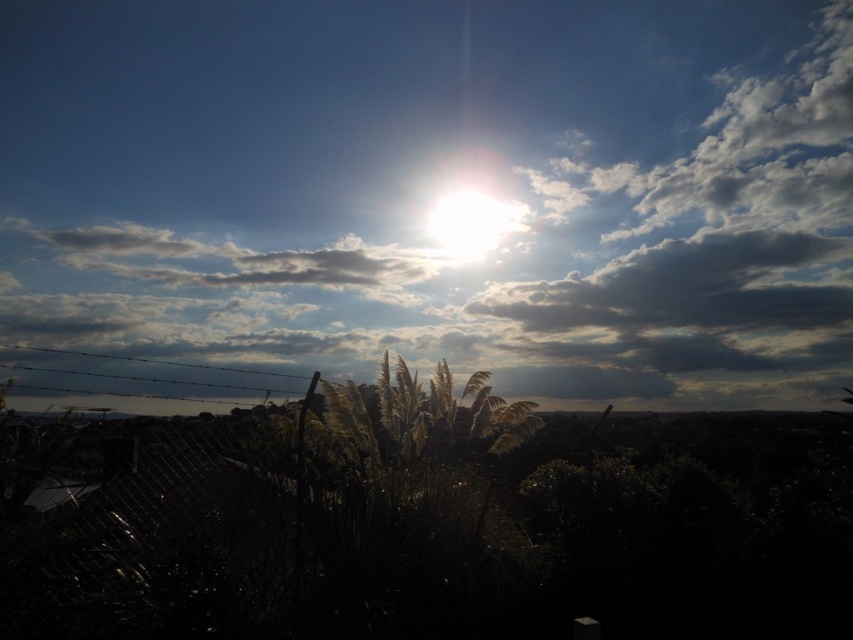
Which is in front, point (692, 193) or point (444, 252)?

Point (444, 252)

Who is shorter, white fluffy cloud at upper center or bright white sun at upper center?

bright white sun at upper center is shorter.

Looking at this image, who is more forward, (134, 44) or (454, 256)?

Point (134, 44) is in front.

At what (x,y) coordinates should I click in order to perform the action: click on white fluffy cloud at upper center. Please return your answer as a coordinate pair (x, y). This screenshot has width=853, height=640. Looking at the image, I should click on (438, 189).

Does white fluffy cloud at upper center appear over silvery grass at center?

Correct, white fluffy cloud at upper center is located above silvery grass at center.

Between point (165, 227) and point (666, 499), which one is positioned behind?

Point (165, 227)

I want to click on white fluffy cloud at upper center, so click(438, 189).

Based on the photo, is silvery grass at center below bright white sun at upper center?

Correct, silvery grass at center is located below bright white sun at upper center.

Is point (227, 500) positioned after point (482, 244)?

No, it is in front of (482, 244).

The height and width of the screenshot is (640, 853). I want to click on silvery grass at center, so click(445, 528).